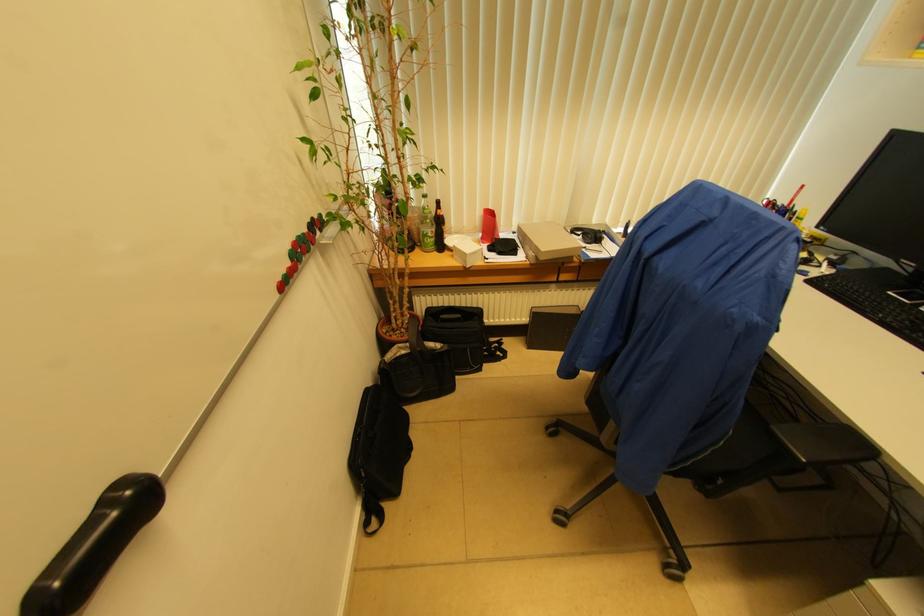
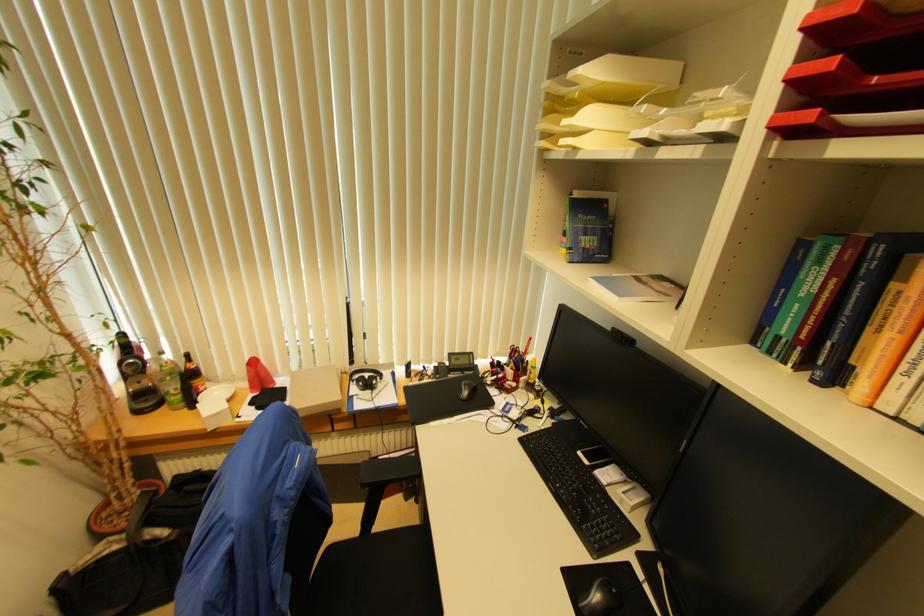
Locate, in the second image, the point that corresponds to point 599,237 in the first image.

(371, 384)